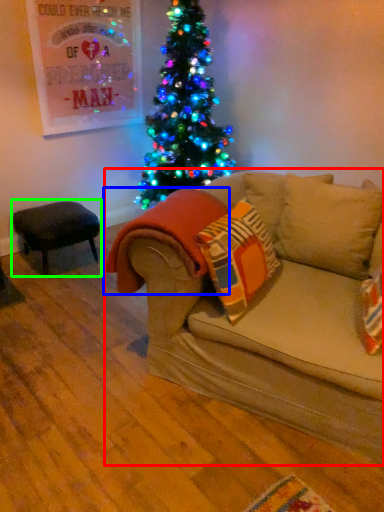
Question: Which object is positioned closest to studio couch (highlighted by a red box)? Select from blanket (highlighted by a blue box) and stool (highlighted by a green box).

Choices:
 (A) blanket
 (B) stool

Answer: (A)